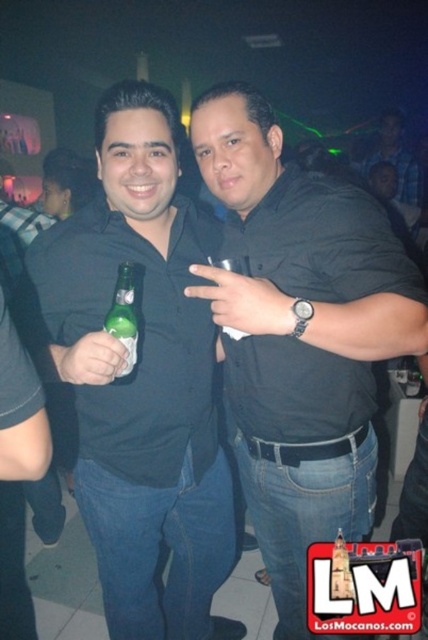
Does black matte shirt at center have a smaller size compared to green glass bottle at center?

Incorrect, black matte shirt at center is not smaller in size than green glass bottle at center.

Is black matte shirt at center bigger than green glass bottle at center?

Indeed, black matte shirt at center has a larger size compared to green glass bottle at center.

Between point (315, 636) and point (128, 284), which one is positioned in front?

Point (128, 284) is more forward.

What are the coordinates of `black matte shirt at center` in the screenshot? It's located at (300, 337).

Is green matte bottle at left bigger than blue plaid shirt at upper right?

Correct, green matte bottle at left is larger in size than blue plaid shirt at upper right.

Does point (183, 250) lie in front of point (419, 193)?

Yes, point (183, 250) is closer to viewer.

The width and height of the screenshot is (428, 640). Identify the location of green matte bottle at left. (139, 380).

Does green matte bottle at left appear under black matte shirt at center?

Incorrect, green matte bottle at left is not positioned below black matte shirt at center.

I want to click on green matte bottle at left, so click(x=139, y=380).